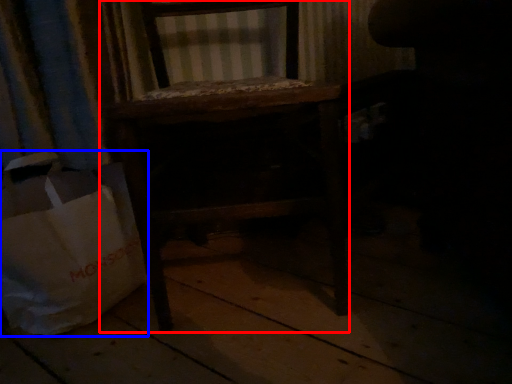
Question: Which point is further to the camera, furniture (highlighted by a red box) or grocery bag (highlighted by a blue box)?

Choices:
 (A) furniture
 (B) grocery bag

Answer: (B)